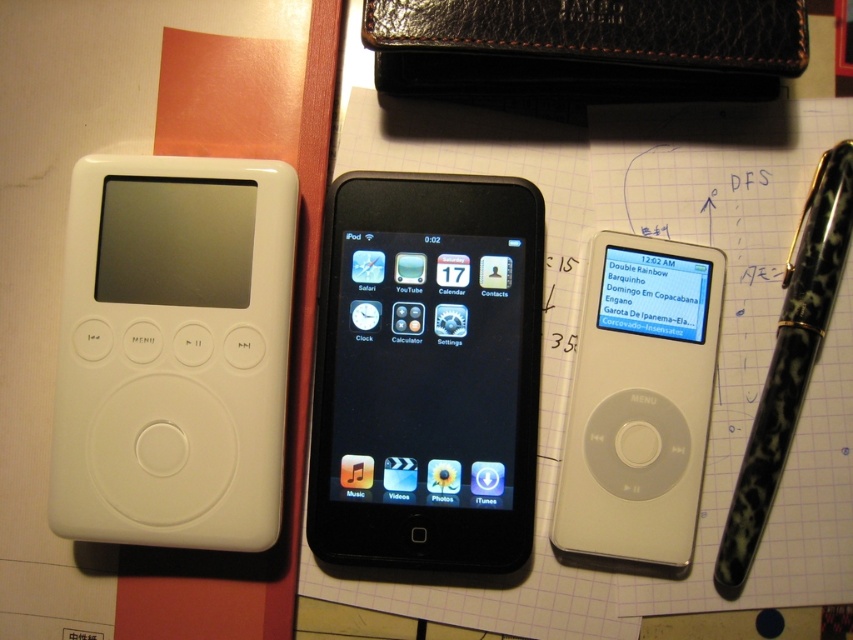
You are organizing a tech exhibition and need to place the black glossy tablet at center and the white matte ipod at center on a shelf. The shelf has a width of 20 cm. Can both items fit side by side without overlapping?

The black glossy tablet at center might be wider than the white matte ipod at center, so it is uncertain if they can fit side by side on a 20 cm shelf. Measure their widths to confirm.

You are a photographer taking a picture of the white matte ipod at left and the white matte ipod at center. Which one will appear larger in your photo?

The white matte ipod at left will appear larger in the photo because it is closer to the viewer than the white matte ipod at center.